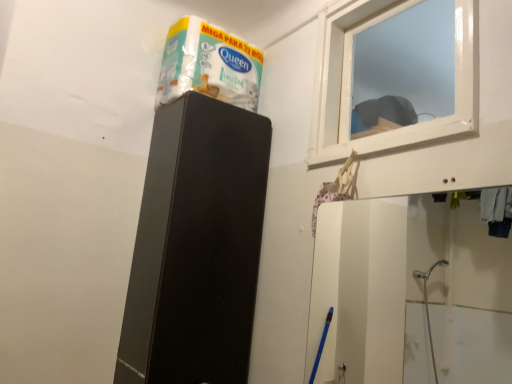
Question: Considering the relative sizes of white glossy tissue box at upper center and transparent plastic window at upper right in the image provided, is white glossy tissue box at upper center taller than transparent plastic window at upper right?

Choices:
 (A) yes
 (B) no

Answer: (B)

Question: Does white glossy tissue box at upper center have a lesser width compared to transparent plastic window at upper right?

Choices:
 (A) yes
 (B) no

Answer: (B)

Question: Is white glossy tissue box at upper center oriented towards transparent plastic window at upper right?

Choices:
 (A) no
 (B) yes

Answer: (B)

Question: Can you confirm if white glossy tissue box at upper center is positioned to the left of transparent plastic window at upper right?

Choices:
 (A) yes
 (B) no

Answer: (A)

Question: Can you confirm if white glossy tissue box at upper center is bigger than transparent plastic window at upper right?

Choices:
 (A) yes
 (B) no

Answer: (B)

Question: Can you confirm if white glossy tissue box at upper center is positioned to the right of transparent plastic window at upper right?

Choices:
 (A) no
 (B) yes

Answer: (A)

Question: Is black matte speaker at upper center aimed at transparent plastic window at upper right?

Choices:
 (A) yes
 (B) no

Answer: (A)

Question: Can you confirm if black matte speaker at upper center is shorter than transparent plastic window at upper right?

Choices:
 (A) yes
 (B) no

Answer: (B)

Question: Is black matte speaker at upper center completely or partially outside of transparent plastic window at upper right?

Choices:
 (A) no
 (B) yes

Answer: (B)

Question: Is black matte speaker at upper center closer to camera compared to transparent plastic window at upper right?

Choices:
 (A) yes
 (B) no

Answer: (B)

Question: Considering the relative positions of black matte speaker at upper center and transparent plastic window at upper right in the image provided, is black matte speaker at upper center to the left of transparent plastic window at upper right from the viewer's perspective?

Choices:
 (A) yes
 (B) no

Answer: (A)

Question: From a real-world perspective, is black matte speaker at upper center positioned under transparent plastic window at upper right based on gravity?

Choices:
 (A) no
 (B) yes

Answer: (B)

Question: Is black matte speaker at upper center at the right side of white glossy tissue box at upper center?

Choices:
 (A) no
 (B) yes

Answer: (A)